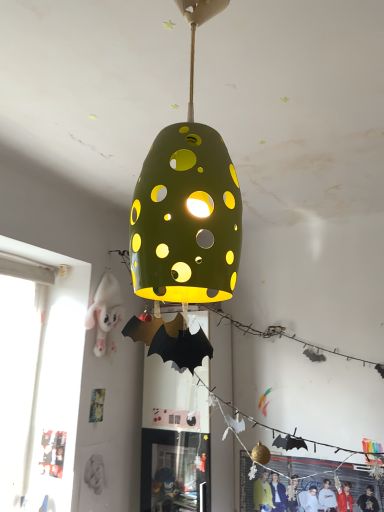
Question: Could white plush toy at left, acting as the 1th person starting from the top, be considered to be inside matte black jacket at lower right, arranged as the 1th person when ordered from the bottom?

Choices:
 (A) no
 (B) yes

Answer: (A)

Question: Is matte black jacket at lower right, which is the 2th person from top to bottom, turned away from white plush toy at left, acting as the 1th person starting from the top?

Choices:
 (A) no
 (B) yes

Answer: (A)

Question: From the image's perspective, is matte black jacket at lower right, placed as the 1th person when sorted from right to left, beneath white plush toy at left, placed as the 2th person when sorted from bottom to top?

Choices:
 (A) yes
 (B) no

Answer: (A)

Question: Considering the relative positions of matte black jacket at lower right, arranged as the 1th person when ordered from the bottom, and white plush toy at left, the 1th person in the left-to-right sequence, in the image provided, is matte black jacket at lower right, arranged as the 1th person when ordered from the bottom, to the right of white plush toy at left, the 1th person in the left-to-right sequence, from the viewer's perspective?

Choices:
 (A) no
 (B) yes

Answer: (B)

Question: Does matte black jacket at lower right, arranged as the 1th person when ordered from the bottom, have a greater height compared to white plush toy at left, the 1th person in the left-to-right sequence?

Choices:
 (A) no
 (B) yes

Answer: (A)

Question: In terms of height, does matte black jacket at lower right, which is the 2th person from top to bottom, look taller or shorter compared to white plush toy at left, acting as the 1th person starting from the top?

Choices:
 (A) tall
 (B) short

Answer: (B)

Question: Considering their positions, is matte black jacket at lower right, which is the 2th person from top to bottom, located in front of or behind white plush toy at left, the 1th person in the left-to-right sequence?

Choices:
 (A) front
 (B) behind

Answer: (A)

Question: From a real-world perspective, relative to white plush toy at left, acting as the 1th person starting from the top, is matte black jacket at lower right, placed as the 1th person when sorted from right to left, vertically above or below?

Choices:
 (A) above
 (B) below

Answer: (B)

Question: Is matte black jacket at lower right, arranged as the 1th person when ordered from the bottom, wider or thinner than white plush toy at left, the 1th person in the left-to-right sequence?

Choices:
 (A) thin
 (B) wide

Answer: (A)

Question: Is matte black jacket at lower right, arranged as the 2th person when viewed from the left, to the left or to the right of green matte lampshade at center in the image?

Choices:
 (A) right
 (B) left

Answer: (A)

Question: From a real-world perspective, relative to green matte lampshade at center, is matte black jacket at lower right, which is the 2th person from top to bottom, vertically above or below?

Choices:
 (A) above
 (B) below

Answer: (B)

Question: Looking at the image, does matte black jacket at lower right, which is the 2th person from top to bottom, seem bigger or smaller compared to green matte lampshade at center?

Choices:
 (A) big
 (B) small

Answer: (B)

Question: Looking at their shapes, would you say matte black jacket at lower right, arranged as the 1th person when ordered from the bottom, is wider or thinner than green matte lampshade at center?

Choices:
 (A) thin
 (B) wide

Answer: (A)

Question: From the image's perspective, relative to matte black jacket at lower right, placed as the 1th person when sorted from right to left, is white plush toy at left, placed as the 2th person when sorted from bottom to top, above or below?

Choices:
 (A) above
 (B) below

Answer: (A)

Question: In terms of width, does white plush toy at left, acting as the 1th person starting from the top, look wider or thinner when compared to matte black jacket at lower right, placed as the 1th person when sorted from right to left?

Choices:
 (A) wide
 (B) thin

Answer: (A)